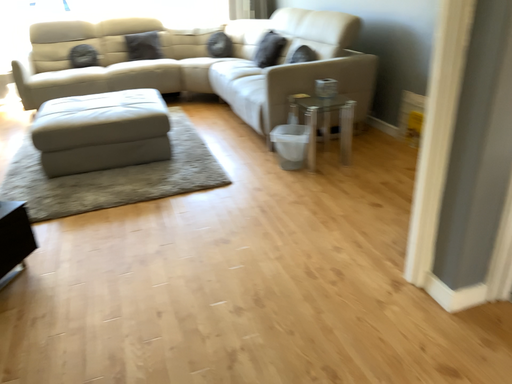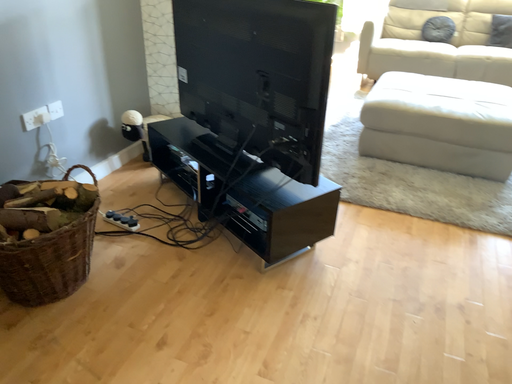
Question: Which way did the camera rotate in the video?

Choices:
 (A) rotated right
 (B) rotated left

Answer: (B)